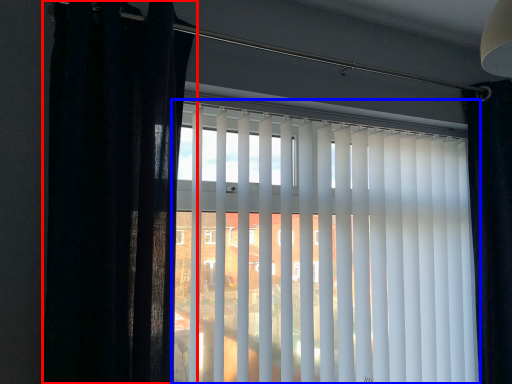
Question: Which object is further to the camera taking this photo, curtain (highlighted by a red box) or window blind (highlighted by a blue box)?

Choices:
 (A) curtain
 (B) window blind

Answer: (B)